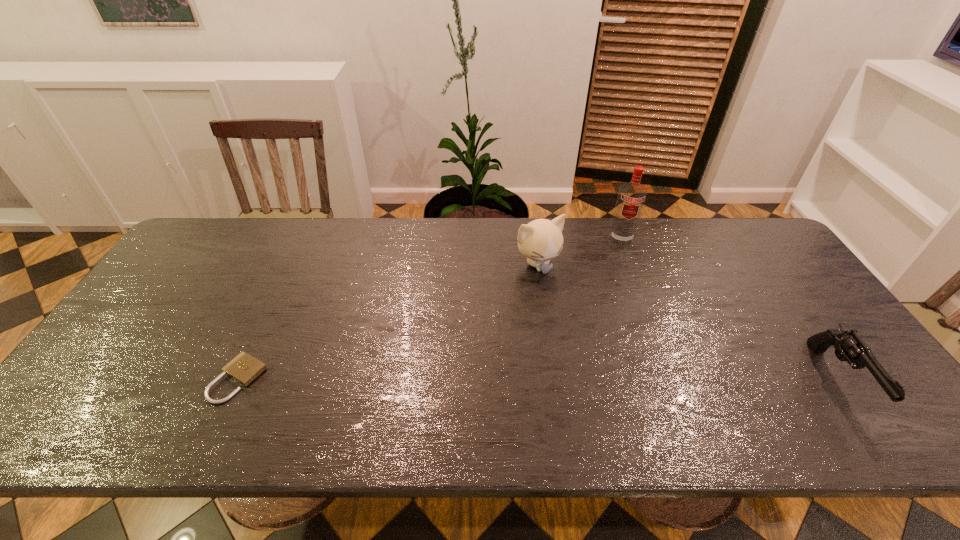
Locate an element on the screen. The width and height of the screenshot is (960, 540). vacant space on the desktop that is between the shortest object and the gun and is positioned on the face of the kitten is located at coordinates (625, 379).

Identify the location of vacant space on the desktop that is between the leftmost object and the third tallest object and is positioned on the front label of the farthest object. (627, 379).